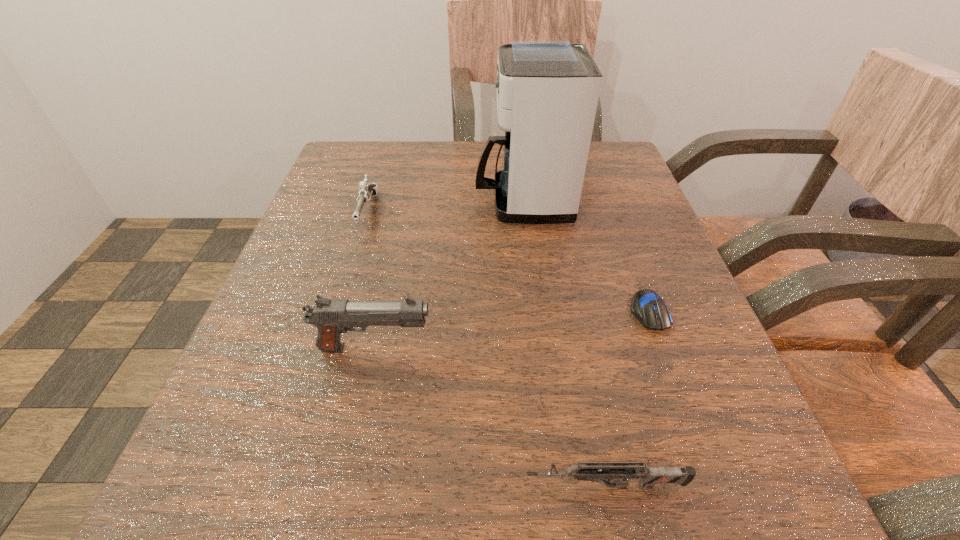
What are the coordinates of `vacant space at the right edge of the desktop` in the screenshot? It's located at (653, 333).

The width and height of the screenshot is (960, 540). In the image, there is a desktop. Identify the location of free space at the near left corner. (287, 537).

Where is `free location at the far right corner of the desktop`? The image size is (960, 540). free location at the far right corner of the desktop is located at coordinates (600, 183).

Locate an element on the screen. vacant area that lies between the tallest gun and the third farthest object is located at coordinates (512, 330).

In order to click on vacant area between the third shortest object and the shortest object in this screenshot , I will do `click(509, 262)`.

You are a GUI agent. You are given a task and a screenshot of the screen. Output one action in this format:
    pyautogui.click(x=<x>, y=<y>)
    Task: Click on the empty space that is in between the computer mouse and the rightmost gun
    
    Given the screenshot: What is the action you would take?
    pyautogui.click(x=627, y=399)

At what (x,y) coordinates should I click in order to perform the action: click on free point between the rightmost object and the coffee maker. Please return your answer as a coordinate pair (x, y). This screenshot has height=540, width=960. Looking at the image, I should click on pos(587,256).

At what (x,y) coordinates should I click in order to perform the action: click on free space between the second nearest object and the third farthest object. Please return your answer as a coordinate pair (x, y). The image size is (960, 540). Looking at the image, I should click on (512, 330).

Locate an element on the screen. free space between the computer mouse and the tallest gun is located at coordinates (512, 330).

Locate an element on the screen. Image resolution: width=960 pixels, height=540 pixels. empty space that is in between the farthest gun and the tallest gun is located at coordinates (372, 280).